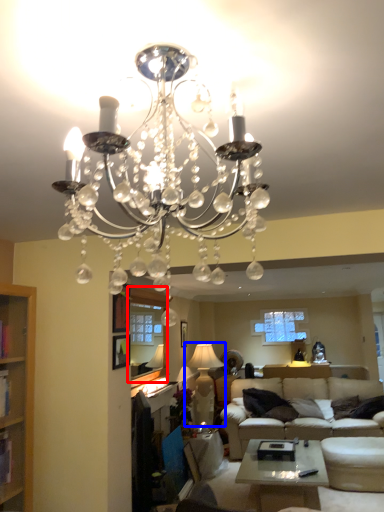
Question: Among these objects, which one is nearest to the camera, window screen (highlighted by a red box) or lamp (highlighted by a blue box)?

Choices:
 (A) window screen
 (B) lamp

Answer: (A)